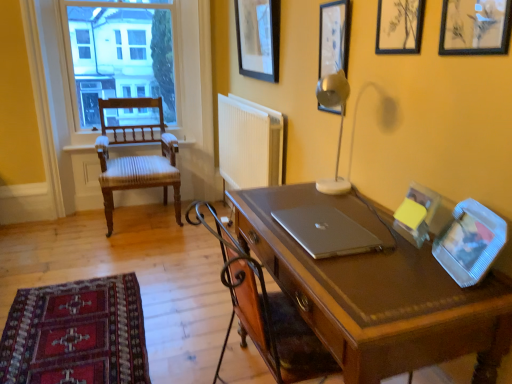
The height and width of the screenshot is (384, 512). What are the coordinates of `free space to the left of clear plastic picture frame at right, which is the 4th picture frame in left-to-right order` in the screenshot? It's located at (401, 270).